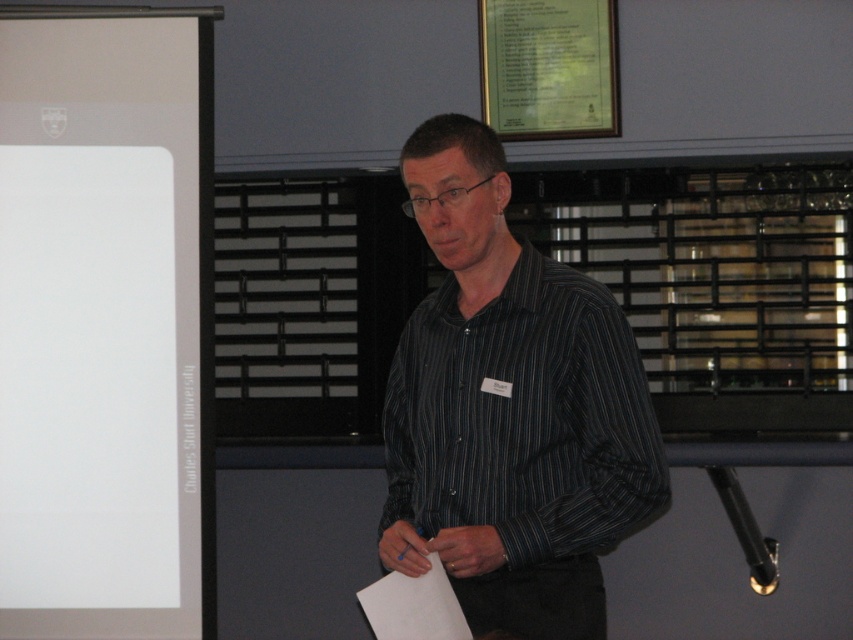
Does point (136, 352) come farther from viewer compared to point (508, 614)?

Yes, it is behind point (508, 614).

Between point (125, 621) and point (453, 202), which one is positioned in front?

Point (453, 202) is in front.

Between point (206, 246) and point (535, 525), which one is positioned in front?

Positioned in front is point (535, 525).

You are a GUI agent. You are given a task and a screenshot of the screen. Output one action in this format:
    pyautogui.click(x=<x>, y=<y>)
    Task: Click on the white matte projection screen at left
    The width and height of the screenshot is (853, 640).
    Given the screenshot: What is the action you would take?
    pyautogui.click(x=105, y=326)

Is point (123, 408) positioned after point (554, 44)?

No, (123, 408) is in front of (554, 44).

Is white matte projection screen at left to the left of green paper at upper center from the viewer's perspective?

Correct, you'll find white matte projection screen at left to the left of green paper at upper center.

Between point (68, 288) and point (500, 28), which one is positioned behind?

The point (500, 28) is behind.

Image resolution: width=853 pixels, height=640 pixels. Identify the location of white matte projection screen at left. (105, 326).

Who is positioned more to the right, dark striped shirt at center or green paper at upper center?

green paper at upper center is more to the right.

Measure the distance from dark striped shirt at center to green paper at upper center.

dark striped shirt at center is 5.26 feet from green paper at upper center.

This screenshot has height=640, width=853. What do you see at coordinates (509, 410) in the screenshot?
I see `dark striped shirt at center` at bounding box center [509, 410].

Identify the location of dark striped shirt at center. The height and width of the screenshot is (640, 853). (509, 410).